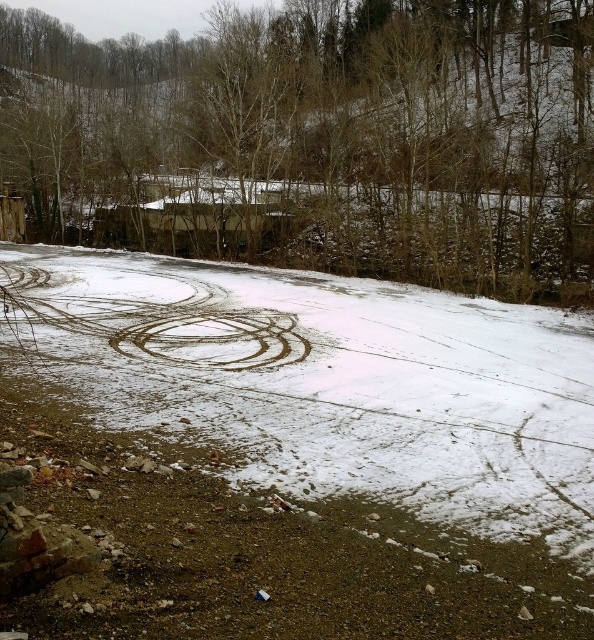
Identify the location of brown leafless tree at center. The width and height of the screenshot is (594, 640). (320, 140).

Does brown leafless tree at center have a greater width compared to brown dirt track at center?

Yes.

Between point (78, 152) and point (150, 291), which one is positioned behind?

The point (78, 152) is behind.

At what (x,y) coordinates should I click in order to perform the action: click on brown leafless tree at center. Please return your answer as a coordinate pair (x, y). This screenshot has height=640, width=594. Looking at the image, I should click on (320, 140).

Is brown gravel dirt track at center wider than brown dirt track at center?

Yes.

Between brown gravel dirt track at center and brown dirt track at center, which one appears on the left side from the viewer's perspective?

Positioned to the left is brown dirt track at center.

Locate an element on the screen. This screenshot has height=640, width=594. brown gravel dirt track at center is located at coordinates (327, 440).

Which is above, brown gravel dirt track at center or brown leafless tree at center?

brown leafless tree at center is above.

Is point (179, 572) less distant than point (345, 250)?

Yes, it is in front of point (345, 250).

Between point (241, 301) and point (486, 22), which one is positioned in front?

Positioned in front is point (241, 301).

Where is `brown gravel dirt track at center`? brown gravel dirt track at center is located at coordinates (327, 440).